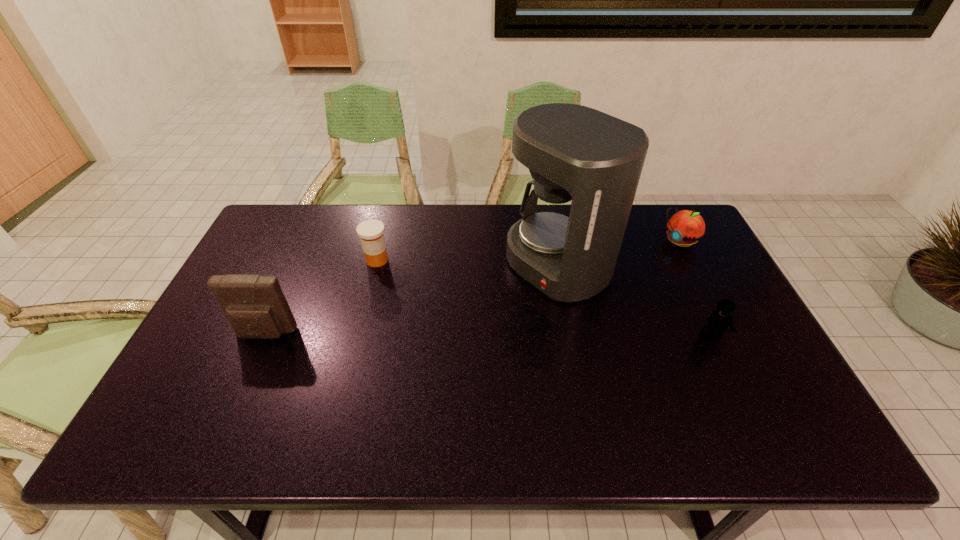
Where is `the leftmost object`? the leftmost object is located at coordinates (255, 306).

This screenshot has height=540, width=960. Find the location of `the fourth shortest object`. the fourth shortest object is located at coordinates (255, 306).

What are the coordinates of `Lego` in the screenshot? It's located at (721, 319).

Where is `the second object from left to right`? This screenshot has width=960, height=540. the second object from left to right is located at coordinates (370, 232).

Where is `the tallest object`? The image size is (960, 540). the tallest object is located at coordinates (586, 165).

Locate an element on the screen. coffee maker is located at coordinates (586, 165).

This screenshot has height=540, width=960. In order to click on apple in this screenshot , I will do `click(685, 227)`.

Find the location of a particular element. The image size is (960, 540). free location located with an open flap on the pouch is located at coordinates (237, 399).

At what (x,y) coordinates should I click in order to perform the action: click on free point located on the front-facing side of the Lego. Please return your answer as a coordinate pair (x, y). Image resolution: width=960 pixels, height=540 pixels. Looking at the image, I should click on (741, 399).

Locate an element on the screen. The width and height of the screenshot is (960, 540). vacant space located 0.100m on the label of the second object from left to right is located at coordinates (402, 284).